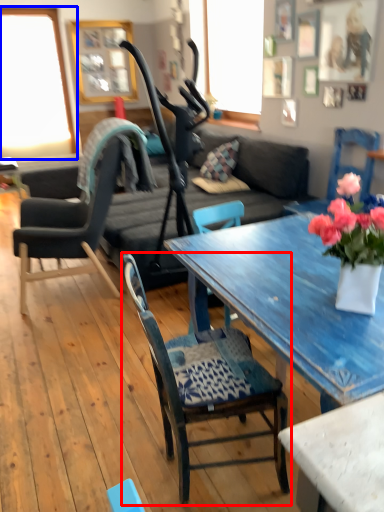
Question: Among these objects, which one is nearest to the camera, chair (highlighted by a red box) or window (highlighted by a blue box)?

Choices:
 (A) chair
 (B) window

Answer: (A)